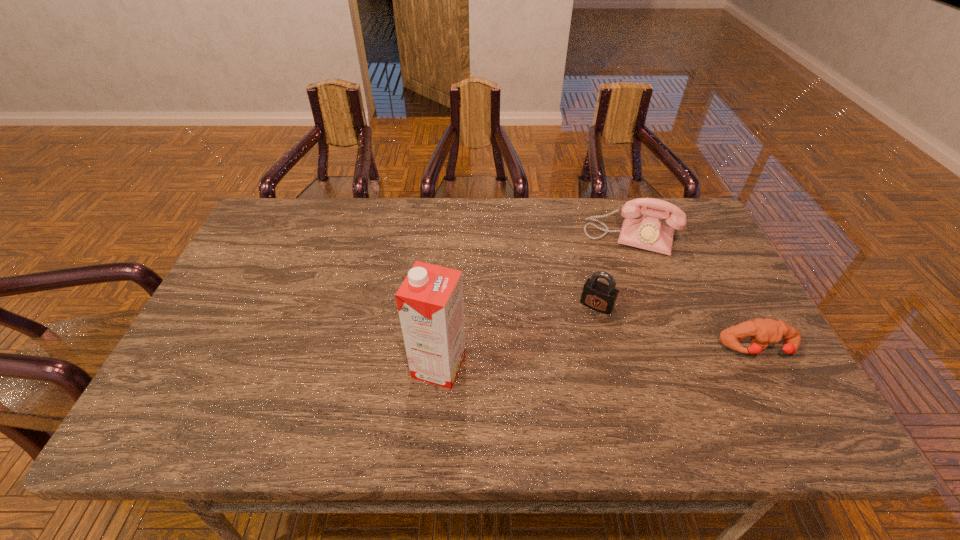
At what (x,y) coordinates should I click in order to perform the action: click on vacant point at the near edge. Please return your answer as a coordinate pair (x, y). The width and height of the screenshot is (960, 540). Looking at the image, I should click on (524, 380).

Find the location of a particular element. This screenshot has height=540, width=960. free space at the left edge of the desktop is located at coordinates (x=270, y=259).

Find the location of a particular element. The image size is (960, 540). vacant region at the right edge of the desktop is located at coordinates (718, 318).

You are a GUI agent. You are given a task and a screenshot of the screen. Output one action in this format:
    pyautogui.click(x=<x>, y=<y>)
    Task: Click on the free space at the far left corner of the desktop
    
    Given the screenshot: What is the action you would take?
    pyautogui.click(x=257, y=228)

You are a GUI agent. You are given a task and a screenshot of the screen. Output one action in this format:
    pyautogui.click(x=<x>, y=<y>)
    Task: Click on the vacant area at the near right corner of the desktop
    The image size is (960, 540).
    Given the screenshot: What is the action you would take?
    pyautogui.click(x=779, y=378)

Where is `unoccupied position between the puncher and the padlock`? Image resolution: width=960 pixels, height=540 pixels. unoccupied position between the puncher and the padlock is located at coordinates (678, 327).

Where is `free space between the padlock and the farthest object`? This screenshot has height=540, width=960. free space between the padlock and the farthest object is located at coordinates (613, 272).

Where is `free space between the telephone and the third tallest object`? free space between the telephone and the third tallest object is located at coordinates (613, 272).

Locate an element on the screen. The height and width of the screenshot is (540, 960). free point between the leftmost object and the second farthest object is located at coordinates (517, 336).

Identify the location of vacant space that is in between the farthest object and the second farthest object. This screenshot has width=960, height=540. 613,272.